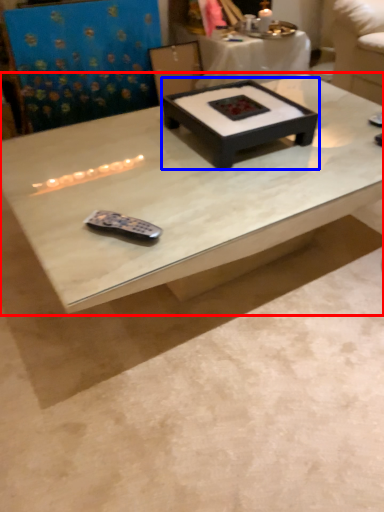
Question: Which object appears closest to the camera in this image, coffee table (highlighted by a red box) or coffee table (highlighted by a blue box)?

Choices:
 (A) coffee table
 (B) coffee table

Answer: (A)